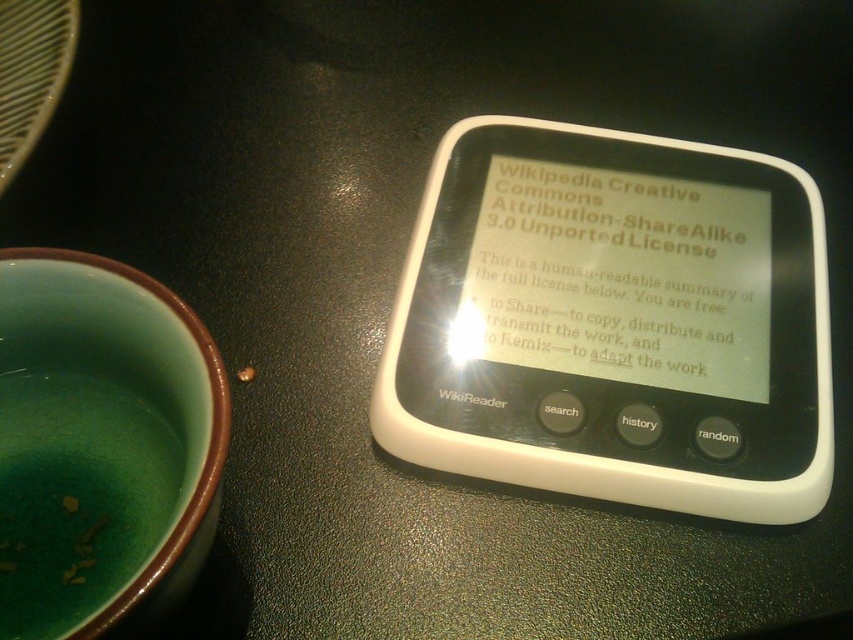
Between black plastic wikireader at center and white paper at center, which one has more height?

black plastic wikireader at center is taller.

Is point (543, 470) positioned in front of point (664, 198)?

Yes, point (543, 470) is closer to viewer.

Where is `black plastic wikireader at center`? black plastic wikireader at center is located at coordinates (614, 321).

The image size is (853, 640). Identify the location of black plastic wikireader at center. (614, 321).

Which is behind, point (512, 260) or point (444, 394)?

Positioned behind is point (512, 260).

Image resolution: width=853 pixels, height=640 pixels. I want to click on black plastic wikireader at center, so coord(614,321).

You are a GUI agent. You are given a task and a screenshot of the screen. Output one action in this format:
    pyautogui.click(x=<x>, y=<y>)
    Task: Click on the black plastic wikireader at center
    
    Given the screenshot: What is the action you would take?
    pyautogui.click(x=614, y=321)

Can you confirm if white paper at center is taller than white matte wikireader at center?

Yes, white paper at center is taller than white matte wikireader at center.

This screenshot has height=640, width=853. Identify the location of white paper at center. (619, 276).

Where is `white paper at center`? The height and width of the screenshot is (640, 853). white paper at center is located at coordinates (619, 276).